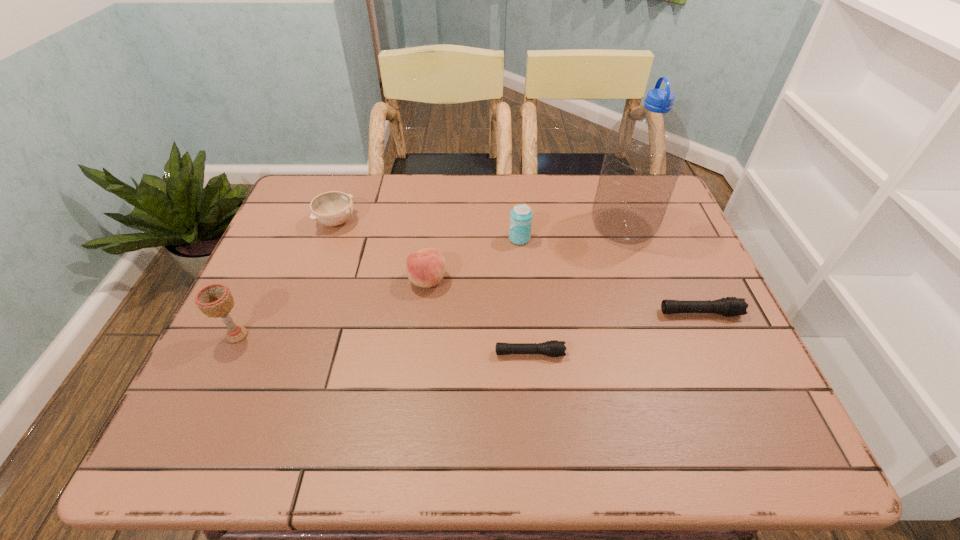
In the current image, all flashlights are evenly spaced. To maintain this equal spacing, where should an additional flashlight be placed on the left? Please point out a free spot. Please provide its 2D coordinates. Your answer should be formatted as a tuple, i.e. [(x, y)], where the tuple contains the x and y coordinates of a point satisfying the conditions above.

[(328, 401)]